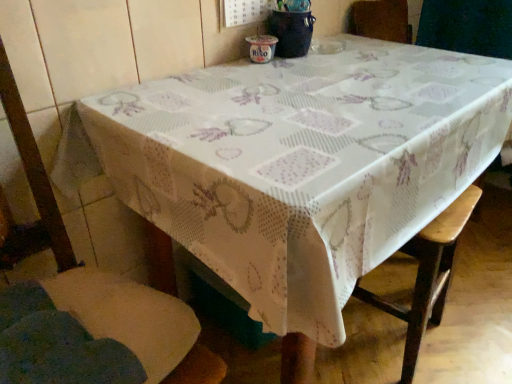
Locate an element on the screen. This screenshot has width=512, height=384. wooden chair at lower left is located at coordinates (34, 166).

Image resolution: width=512 pixels, height=384 pixels. Describe the element at coordinates (34, 166) in the screenshot. I see `wooden chair at lower left` at that location.

Image resolution: width=512 pixels, height=384 pixels. Describe the element at coordinates (426, 276) in the screenshot. I see `wooden bar stool at lower right` at that location.

Locate an element on the screen. The width and height of the screenshot is (512, 384). wooden bar stool at lower right is located at coordinates (426, 276).

The image size is (512, 384). I want to click on wooden chair at lower left, so click(x=34, y=166).

Based on their positions, is wooden bar stool at lower right located to the left or right of wooden chair at lower left?

Based on their positions, wooden bar stool at lower right is located to the right of wooden chair at lower left.

Is the position of wooden bar stool at lower right more distant than that of wooden chair at lower left?

Yes, the depth of wooden bar stool at lower right is greater than that of wooden chair at lower left.

Is point (455, 246) positioned after point (196, 380)?

Yes, point (455, 246) is farther from viewer.

From the image's perspective, is wooden bar stool at lower right positioned above or below wooden chair at lower left?

wooden bar stool at lower right is situated lower than wooden chair at lower left in the image.

From a real-world perspective, which object rests below the other?

From a 3D spatial view, wooden bar stool at lower right is below.

Which object is wider, wooden bar stool at lower right or wooden chair at lower left?

wooden chair at lower left is wider.

In terms of height, does wooden bar stool at lower right look taller or shorter compared to wooden chair at lower left?

Considering their sizes, wooden bar stool at lower right has less height than wooden chair at lower left.

Considering the relative sizes of wooden bar stool at lower right and wooden chair at lower left in the image provided, is wooden bar stool at lower right smaller than wooden chair at lower left?

Correct, wooden bar stool at lower right occupies less space than wooden chair at lower left.

Is wooden bar stool at lower right positioned beyond the bounds of wooden chair at lower left?

Yes, wooden bar stool at lower right is not within wooden chair at lower left.

Is wooden bar stool at lower right far from wooden chair at lower left?

They are positioned close to each other.

Is wooden bar stool at lower right oriented towards wooden chair at lower left?

No, wooden bar stool at lower right is not oriented towards wooden chair at lower left.

Can you tell me how much wooden bar stool at lower right and wooden chair at lower left differ in facing direction?

174 degrees.

I want to click on bar stool on the right of wooden chair at lower left, so click(x=426, y=276).

Which object is positioned more to the right, wooden chair at lower left or wooden bar stool at lower right?

From the viewer's perspective, wooden bar stool at lower right appears more on the right side.

Which is behind, wooden chair at lower left or wooden bar stool at lower right?

wooden bar stool at lower right is further from the camera.

Does point (19, 96) come farther from viewer compared to point (450, 231)?

No.

From the image's perspective, is wooden chair at lower left located beneath wooden bar stool at lower right?

No, from the image's perspective, wooden chair at lower left is not below wooden bar stool at lower right.

From a real-world perspective, is wooden chair at lower left located higher than wooden bar stool at lower right?

Yes, from a real-world perspective, wooden chair at lower left is above wooden bar stool at lower right.

Considering the sizes of wooden chair at lower left and wooden bar stool at lower right in the image, is wooden chair at lower left wider or thinner than wooden bar stool at lower right?

Considering their sizes, wooden chair at lower left looks broader than wooden bar stool at lower right.

Which of these two, wooden chair at lower left or wooden bar stool at lower right, stands taller?

wooden chair at lower left.

Can you confirm if wooden chair at lower left is bigger than wooden bar stool at lower right?

Indeed, wooden chair at lower left has a larger size compared to wooden bar stool at lower right.

Is wooden chair at lower left completely or partially outside of wooden bar stool at lower right?

Yes, wooden chair at lower left is located beyond the bounds of wooden bar stool at lower right.

Is wooden chair at lower left next to wooden bar stool at lower right?

No, wooden chair at lower left is not beside wooden bar stool at lower right.

Is wooden chair at lower left facing towards wooden bar stool at lower right?

No, wooden chair at lower left is not aimed at wooden bar stool at lower right.

Based on the photo, can you tell me how much wooden chair at lower left and wooden bar stool at lower right differ in facing direction?

174 degrees.

I want to click on chair to the left of wooden bar stool at lower right, so click(x=34, y=166).

Identify the location of bar stool below the wooden chair at lower left (from a real-world perspective). This screenshot has height=384, width=512. click(x=426, y=276).

At what (x,y) coordinates should I click in order to perform the action: click on chair on the left of wooden bar stool at lower right. Please return your answer as a coordinate pair (x, y). Looking at the image, I should click on (34, 166).